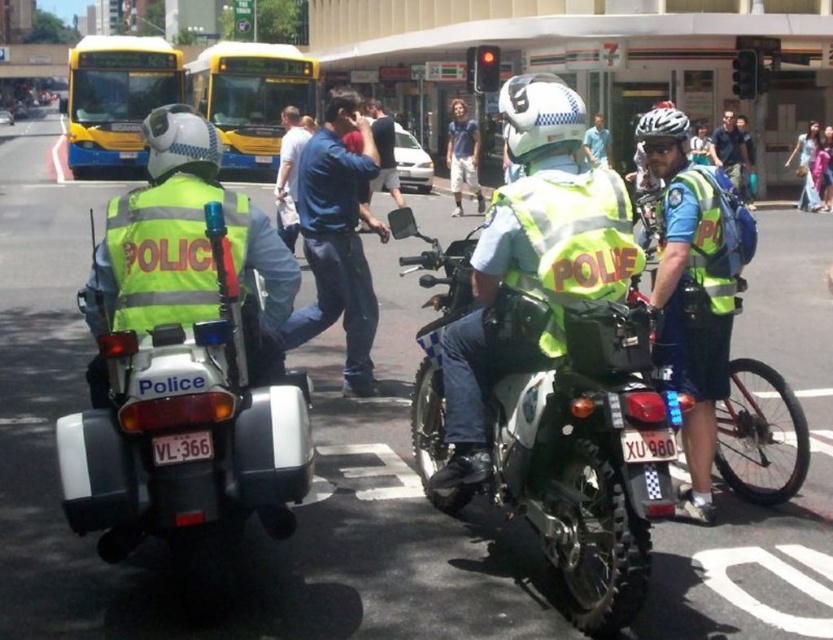
Who is positioned more to the left, white matte police motorcycle at left or yellowmetallicbus at upper center?

Positioned to the left is yellowmetallicbus at upper center.

Is point (235, 486) positioned after point (187, 88)?

No, it is in front of (187, 88).

Where is `white matte police motorcycle at left`? white matte police motorcycle at left is located at coordinates (188, 435).

Which is above, green matte motorcycle at center or light blue shirt at center?

light blue shirt at center

Which is more to the right, green matte motorcycle at center or light blue shirt at center?

light blue shirt at center is more to the right.

Does point (616, 368) come closer to viewer compared to point (742, 161)?

Yes, point (616, 368) is closer to viewer.

Find the location of a particular element. Image resolution: width=833 pixels, height=640 pixels. green matte motorcycle at center is located at coordinates (560, 442).

Who is taller, green matte motorcycle at center or reflective blue shirt at center?

Standing taller between the two is reflective blue shirt at center.

Looking at this image, does green matte motorcycle at center lie in front of reflective blue shirt at center?

Yes, it is in front of reflective blue shirt at center.

Does point (552, 499) come in front of point (709, 509)?

Yes.

Locate an element on the screen. This screenshot has width=833, height=640. green matte motorcycle at center is located at coordinates click(x=560, y=442).